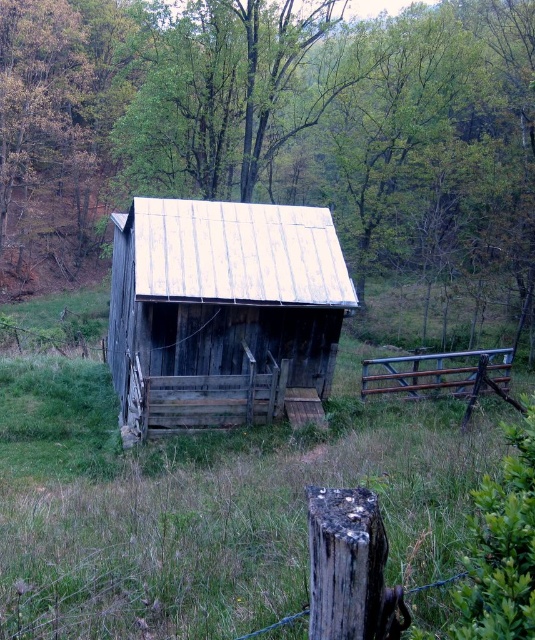
You are standing in front of the shed and see the green wood tree at center and the weathered brown wood at lower center. Which object is located to the left of the other?

The green wood tree at center is positioned on the left side of weathered brown wood at lower center.